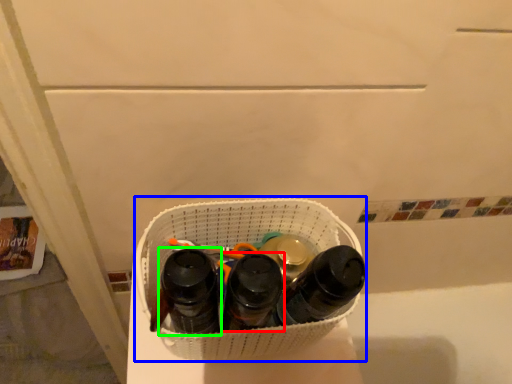
Question: Which object is the farthest from footwear (highlighted by a red box)? Choose among these: laundry basket (highlighted by a blue box) or footwear (highlighted by a green box).

Choices:
 (A) laundry basket
 (B) footwear

Answer: (A)